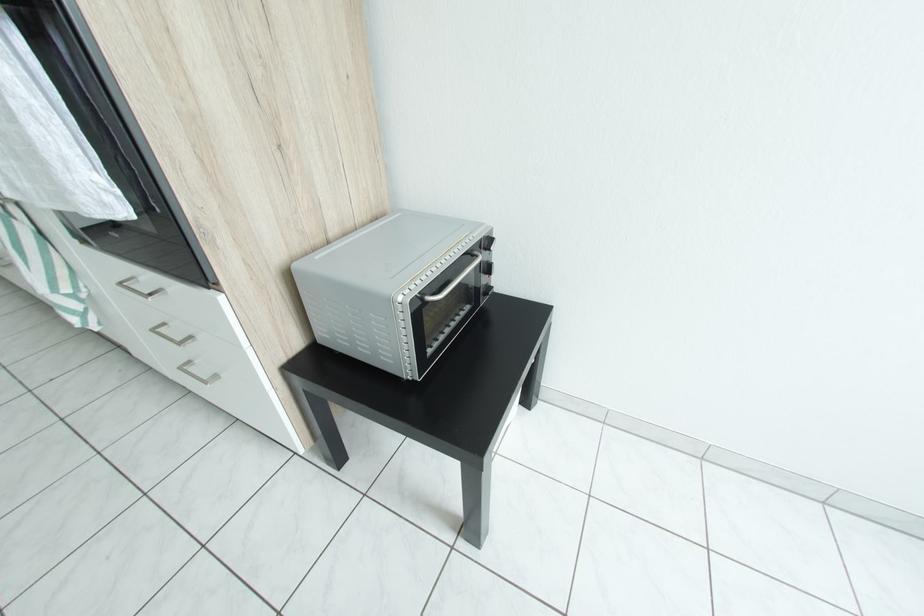
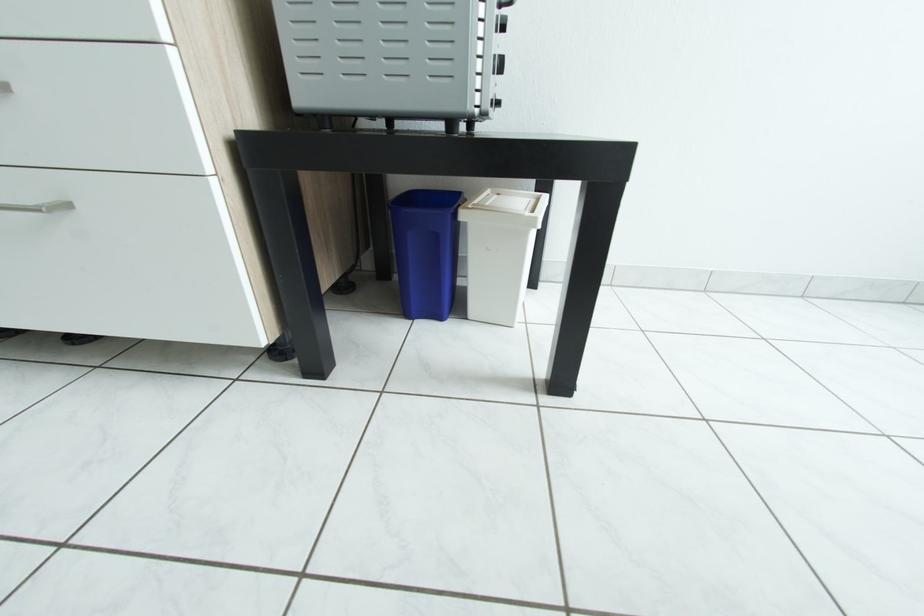
In a continuous first-person perspective shot, in which direction is the camera moving?

The cameraman walked toward left, forward.